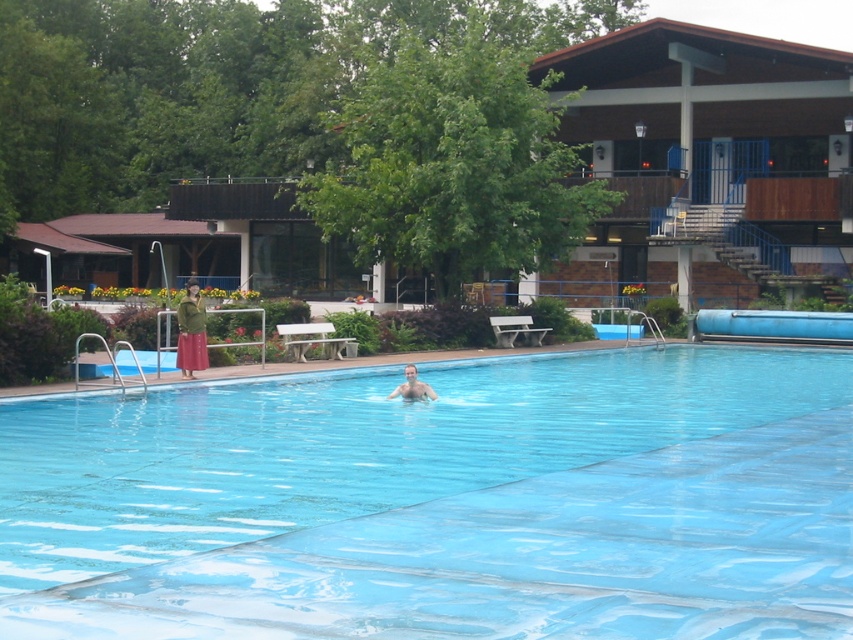
Question: Among these objects, which one is farthest from the camera?

Choices:
 (A) smooth skin person at center
 (B) green textured dress at left
 (C) transparent plastic pool at center

Answer: (B)

Question: Which point appears farthest from the camera in this image?

Choices:
 (A) (180, 308)
 (B) (62, 589)

Answer: (A)

Question: Is transparent plastic pool at center behind smooth skin person at center?

Choices:
 (A) yes
 (B) no

Answer: (B)

Question: Is transparent plastic pool at center positioned before green textured dress at left?

Choices:
 (A) yes
 (B) no

Answer: (A)

Question: Which point is farther to the camera?

Choices:
 (A) (198, 355)
 (B) (390, 396)
 (C) (556, 461)

Answer: (A)

Question: Is transparent plastic pool at center smaller than green textured dress at left?

Choices:
 (A) no
 (B) yes

Answer: (B)